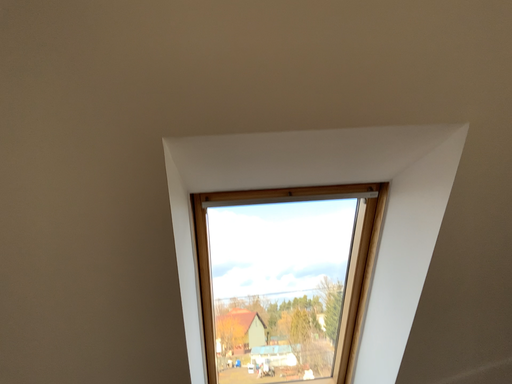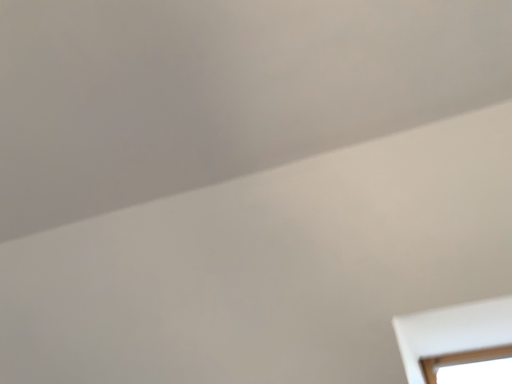
Question: How did the camera likely rotate when shooting the video?

Choices:
 (A) rotated left
 (B) rotated right

Answer: (A)